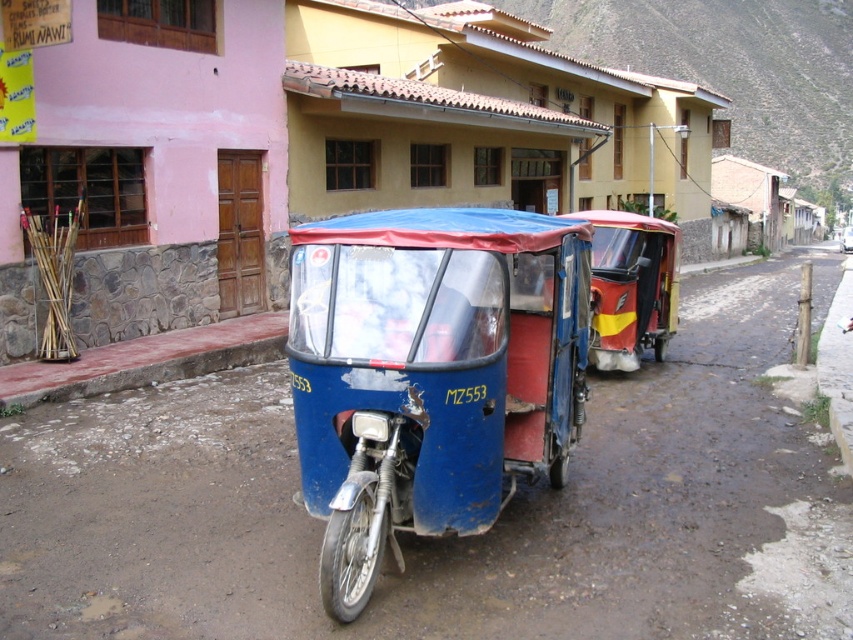
Does point (428, 360) come in front of point (584, 212)?

Yes, it is.

Is point (440, 515) positioned in front of point (674, 328)?

Yes, point (440, 515) is in front of point (674, 328).

Where is `blue matte tricycle at center`? The image size is (853, 640). blue matte tricycle at center is located at coordinates (430, 372).